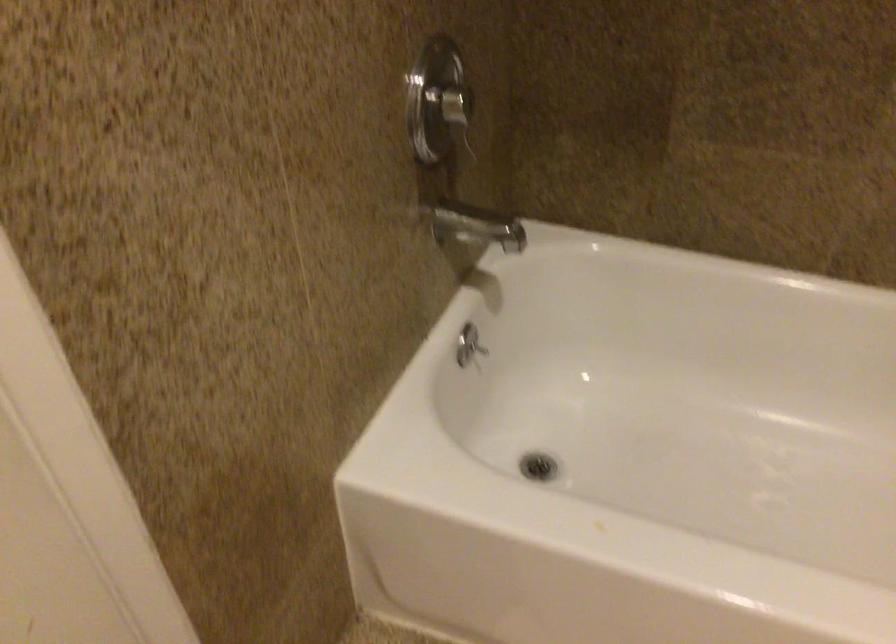
The height and width of the screenshot is (644, 896). Identify the location of spout diverter knob. (478, 348).